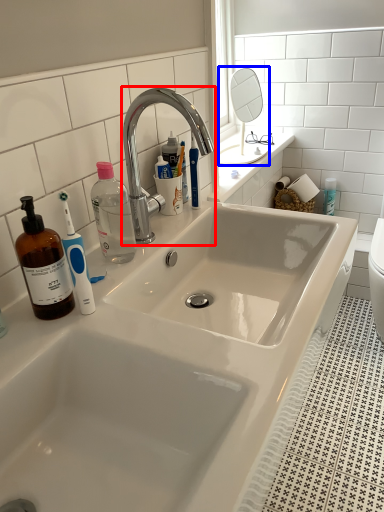
Question: Among these objects, which one is nearest to the camera, tap (highlighted by a red box) or mirror (highlighted by a blue box)?

Choices:
 (A) tap
 (B) mirror

Answer: (A)